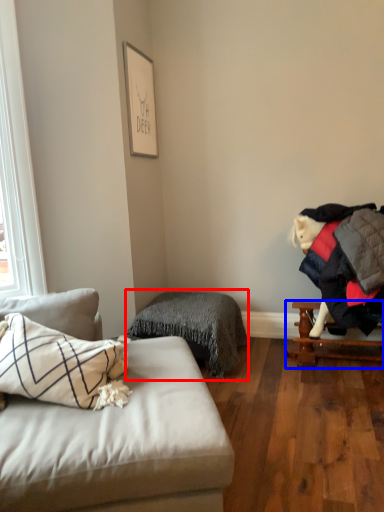
Question: Which of the following is the closest to the observer, bedding (highlighted by a red box) or table (highlighted by a blue box)?

Choices:
 (A) bedding
 (B) table

Answer: (B)